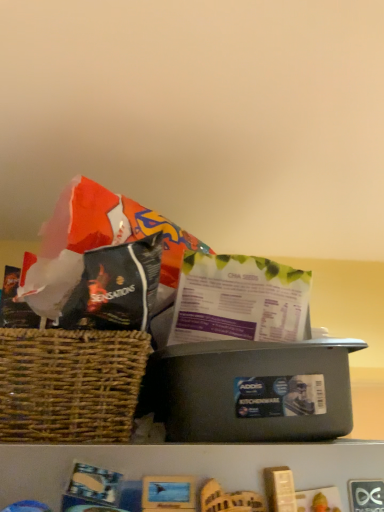
Question: Would you say green paper gift bag at center is to the left or to the right of matte black plastic container at center in the picture?

Choices:
 (A) right
 (B) left

Answer: (A)

Question: From the image's perspective, relative to matte black plastic container at center, is green paper gift bag at center above or below?

Choices:
 (A) below
 (B) above

Answer: (B)

Question: Is green paper gift bag at center spatially inside matte black plastic container at center, or outside of it?

Choices:
 (A) outside
 (B) inside

Answer: (A)

Question: Considering the positions of matte black plastic container at center and green paper gift bag at center in the image, is matte black plastic container at center bigger or smaller than green paper gift bag at center?

Choices:
 (A) big
 (B) small

Answer: (A)

Question: Is matte black plastic container at center to the left or to the right of green paper gift bag at center in the image?

Choices:
 (A) right
 (B) left

Answer: (B)

Question: In the image, is matte black plastic container at center positioned in front of or behind green paper gift bag at center?

Choices:
 (A) front
 (B) behind

Answer: (A)

Question: From the image's perspective, is matte black plastic container at center positioned above or below green paper gift bag at center?

Choices:
 (A) below
 (B) above

Answer: (A)